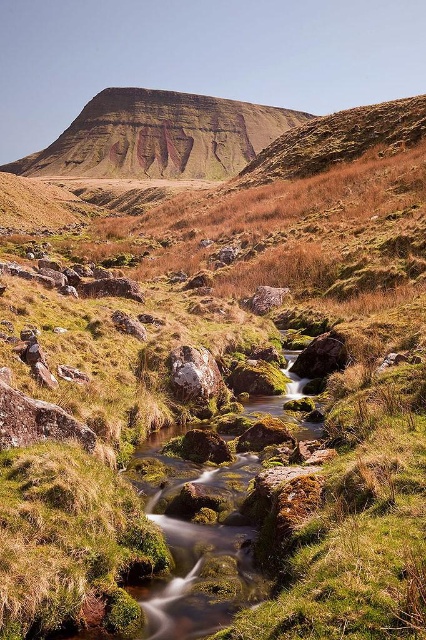
Question: Does rustic brown rock formation at center appear under smooth gray rock at center?

Choices:
 (A) yes
 (B) no

Answer: (B)

Question: Estimate the real-world distances between objects in this image. Which object is farther from the rustic brown rock formation at center?

Choices:
 (A) smooth gray rock at center
 (B) rusty metallic rock at center

Answer: (A)

Question: Which point is farther to the camera?

Choices:
 (A) (264, 285)
 (B) (218, 170)
 (C) (172, 380)

Answer: (B)

Question: Where is rustic brown rock formation at center located in relation to rusty metallic rock at center in the image?

Choices:
 (A) left
 (B) right

Answer: (A)

Question: Which is farther from the smooth gray rock at center?

Choices:
 (A) rusty metallic rock at center
 (B) rustic brown rock formation at center

Answer: (B)

Question: Is rusty metallic rock at center closer to camera compared to smooth gray rock at center?

Choices:
 (A) no
 (B) yes

Answer: (B)